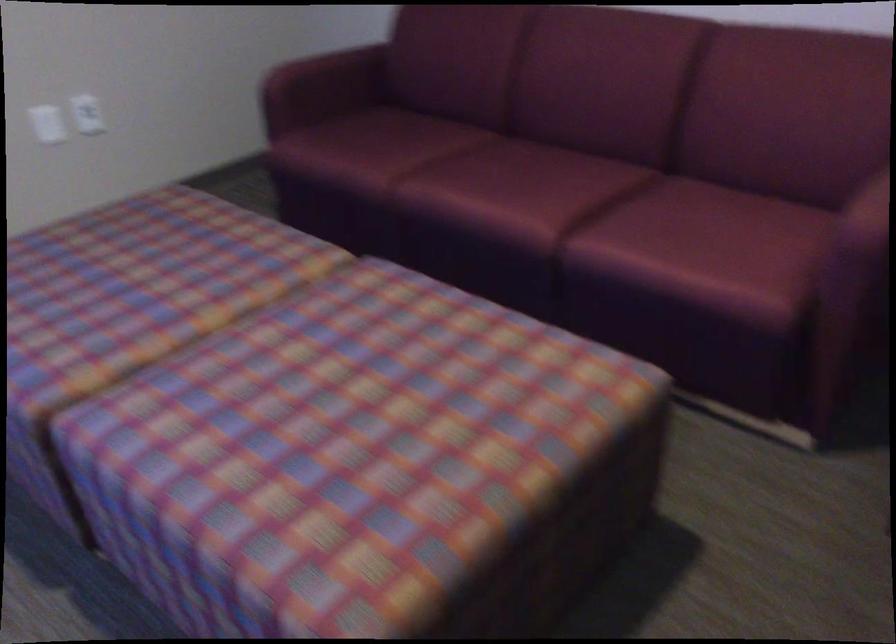
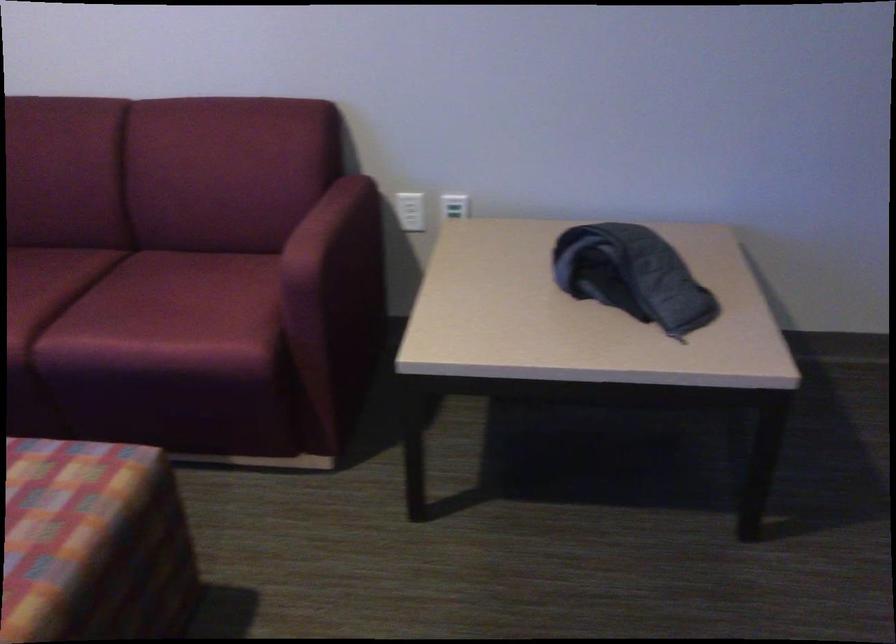
Question: Based on the continuous images, in which direction is the camera rotating? Reply with the corresponding letter.

Choices:
 (A) Left
 (B) Right
 (C) Up
 (D) Down

Answer: (B)